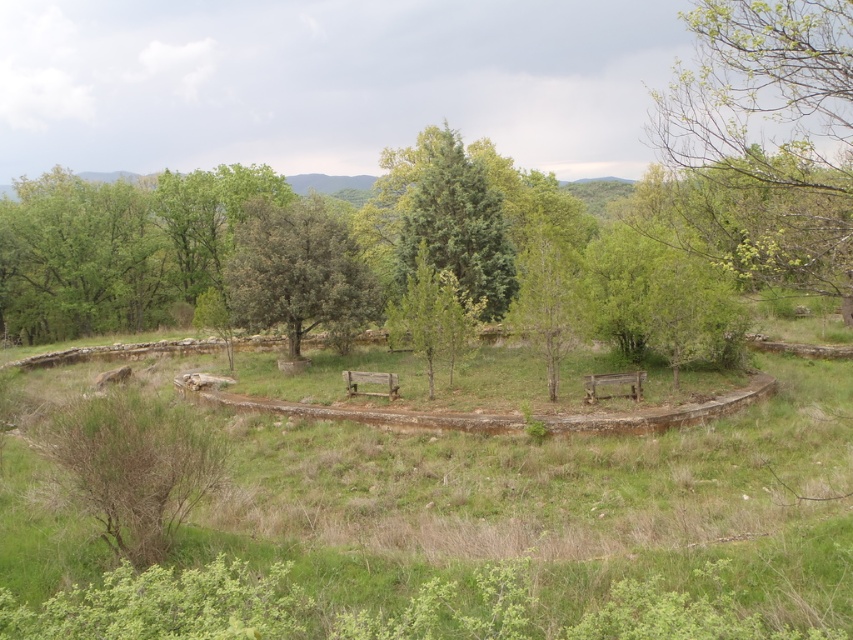
You are planning to install a new bench between the green leafy tree at upper left and the green textured tree at center. The bench requires a minimum of 20 meters of space between the two trees to be placed safely. Can you install the bench here?

The distance between the green leafy tree at upper left and the green textured tree at center is 18.16 meters, which is less than the required 20 meters. Therefore, you cannot install the bench here safely.

You are planning to place a picnic blanket between the green leafy tree at center and the green textured tree at center. Given that the blanket is 4 meters long, will it fit entirely between them?

The distance between the green leafy tree at center and the green textured tree at center is 4.49 meters, which is longer than the 4 meter length of the picnic blanket. Therefore, the blanket will fit entirely between them with some space to spare.

From the picture: You are standing at the point with coordinates point (79, 259). Looking around, you see a green leafy tree at upper left. Which direction should you face to see the green leafy tree at upper left?

You should face the upper left direction to see the green leafy tree at upper left as the point (79, 259) corresponds to that location.